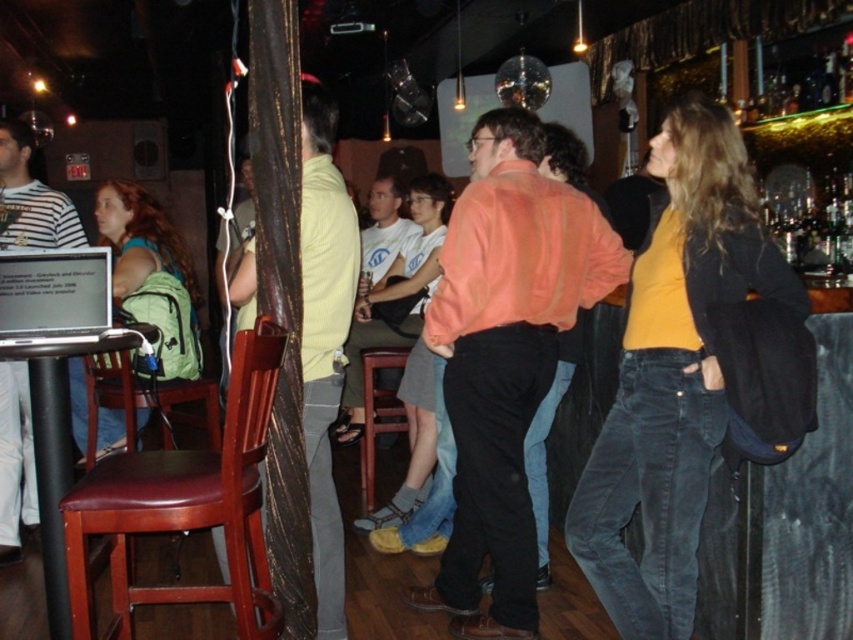
You are a photographer trying to capture a candid shot of the matte orange shirt at center and the white cotton shirt at center. Since the two subjects are close, you want to ensure both are in focus. Based on their positions, which subject should you focus on to maximize the chances of both being sharp?

The matte orange shirt at center is in front of the white cotton shirt at center, so focusing on the matte orange shirt at center will help ensure both are in focus as much as possible.

You are a photographer trying to capture a candid shot of the two people in the center of the image. The subjects are wearing a matte orange shirt at center and a white cotton shirt at center. Based on their positions, which one is positioned lower in the frame?

The matte orange shirt at center is below the white cotton shirt at center, so the person wearing the matte orange shirt at center is positioned lower in the frame.